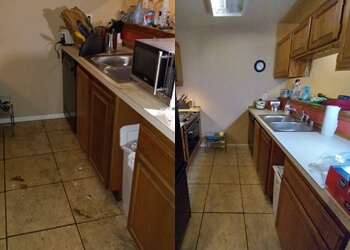
The height and width of the screenshot is (250, 350). I want to click on white counter, so click(304, 152).